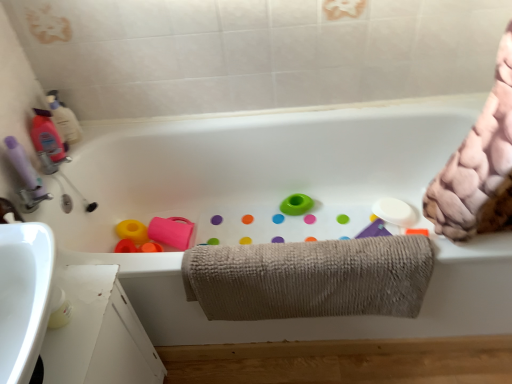
Identify the location of vacant space situated above beige textured towel at center (from a real-world perspective). The image size is (512, 384). (314, 249).